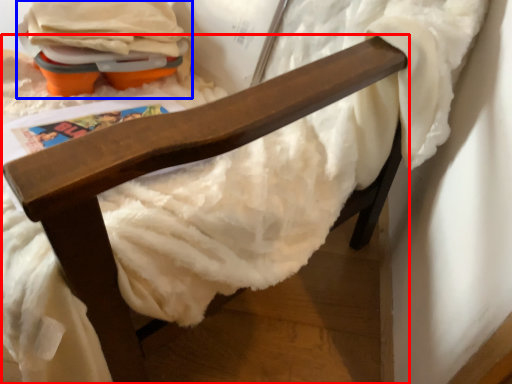
Question: Among these objects, which one is farthest to the camera, furniture (highlighted by a red box) or toy (highlighted by a blue box)?

Choices:
 (A) furniture
 (B) toy

Answer: (B)